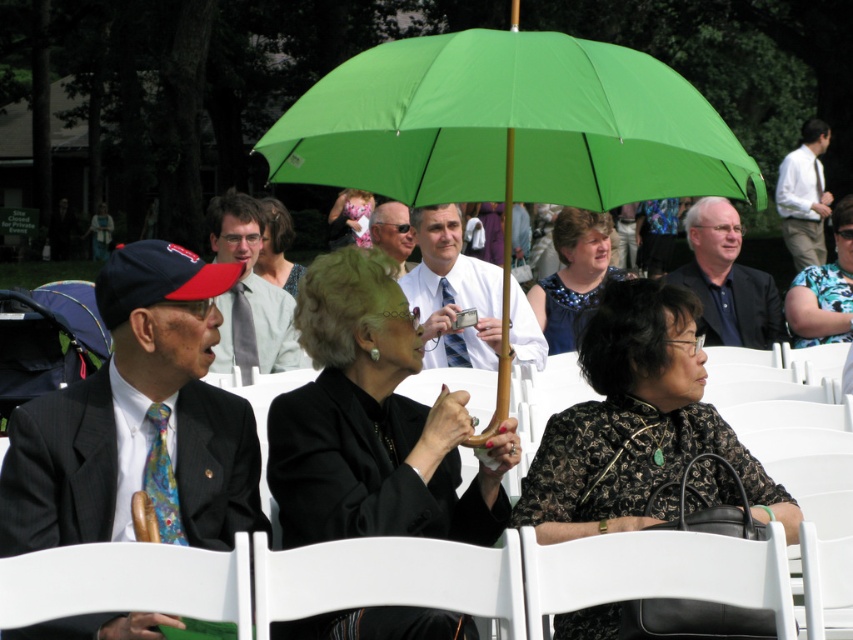
Does white shirt at upper center appear under matte gray sweater at center?

Incorrect, white shirt at upper center is not positioned below matte gray sweater at center.

Is point (813, 150) more distant than point (273, 221)?

Yes, point (813, 150) is behind point (273, 221).

Who is more distant from viewer, (828, 208) or (263, 248)?

Point (828, 208)

I want to click on white shirt at upper center, so click(x=804, y=196).

What do you see at coordinates (451, 292) in the screenshot? I see `white shirt at center` at bounding box center [451, 292].

Find the location of `white shirt at center`. white shirt at center is located at coordinates (451, 292).

What do you see at coordinates (824, 289) in the screenshot? This screenshot has width=853, height=640. I see `floral print blouse at center` at bounding box center [824, 289].

Is floral print blouse at center shorter than matte gray sweater at center?

No.

Identify the location of floral print blouse at center. (824, 289).